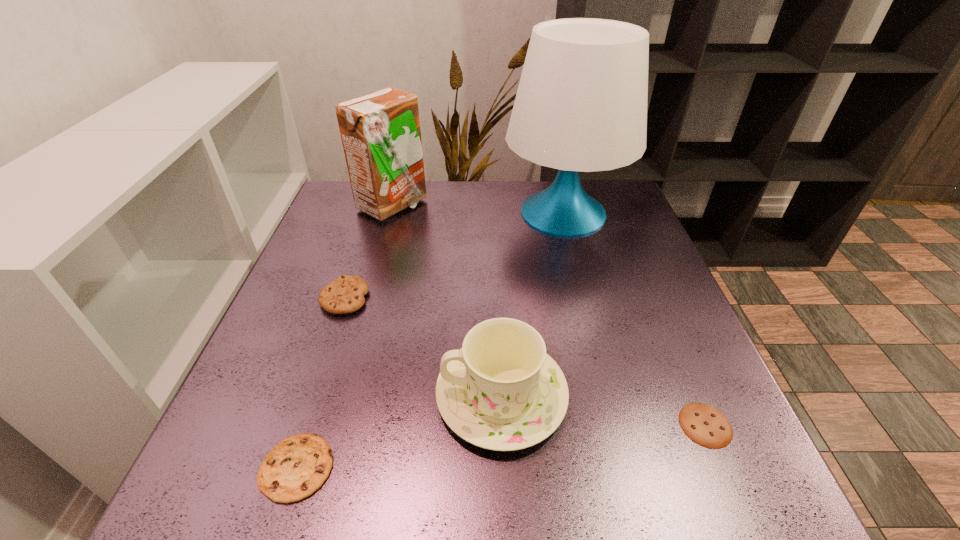
In order to click on table lamp that is at the right edge in this screenshot , I will do `click(581, 105)`.

The image size is (960, 540). Identify the location of cookie that is positioned at the right edge. (705, 425).

Identify the location of object that is positioned at the far left corner. Image resolution: width=960 pixels, height=540 pixels. (381, 136).

The image size is (960, 540). Identify the location of object that is at the near left corner. (295, 468).

The width and height of the screenshot is (960, 540). Find the location of `object that is at the far right corner`. object that is at the far right corner is located at coordinates (581, 105).

Identify the location of vacant space at the far edge of the desktop. The width and height of the screenshot is (960, 540). (496, 206).

Image resolution: width=960 pixels, height=540 pixels. Identify the location of vacant space at the near edge. (523, 518).

The width and height of the screenshot is (960, 540). In the image, there is a desktop. What are the coordinates of `vacant region at the left edge` in the screenshot? It's located at (299, 271).

Locate an element on the screen. vacant region at the right edge of the desktop is located at coordinates (600, 254).

This screenshot has width=960, height=540. In the image, there is a desktop. What are the coordinates of `free region at the far left corner` in the screenshot? It's located at (329, 220).